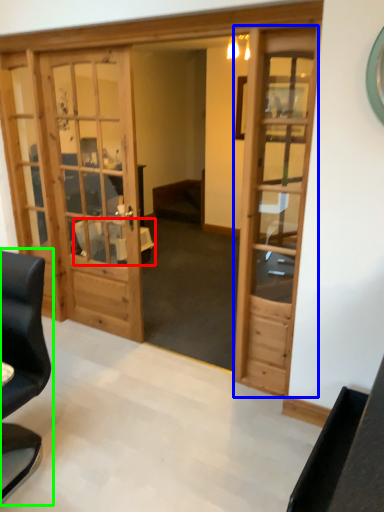
Question: Estimate the real-world distances between objects in this image. Which object is closer to table (highlighted by a red box), door (highlighted by a blue box) or chair (highlighted by a green box)?

Choices:
 (A) door
 (B) chair

Answer: (A)